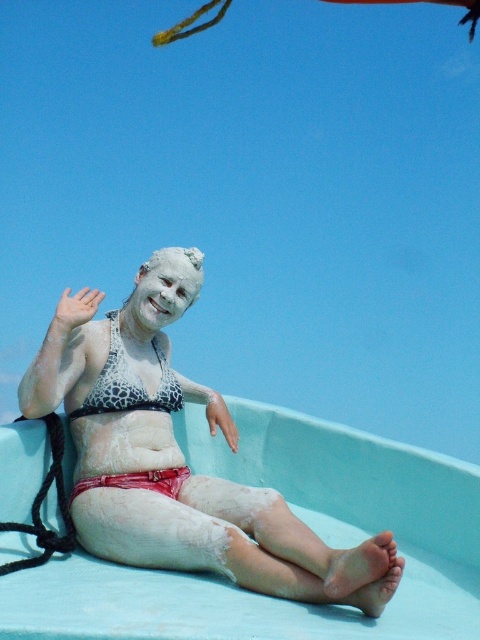
Question: Which of the following is the closest to the observer?

Choices:
 (A) (110, 310)
 (B) (180, 266)

Answer: (B)

Question: Is leopard print bikini top at center below white matte face at center?

Choices:
 (A) no
 (B) yes

Answer: (B)

Question: Which point is farther to the camera?

Choices:
 (A) white matte bikini at center
 (B) white matte face at center

Answer: (B)

Question: Which point is farther from the camera taking this photo?

Choices:
 (A) (173, 248)
 (B) (376, 552)

Answer: (A)

Question: Is white matte bikini at center bigger than white matte face at center?

Choices:
 (A) yes
 (B) no

Answer: (A)

Question: Does leopard print bikini top at center appear on the left side of white matte face at center?

Choices:
 (A) yes
 (B) no

Answer: (A)